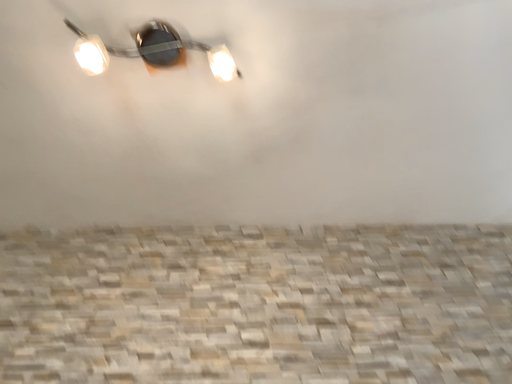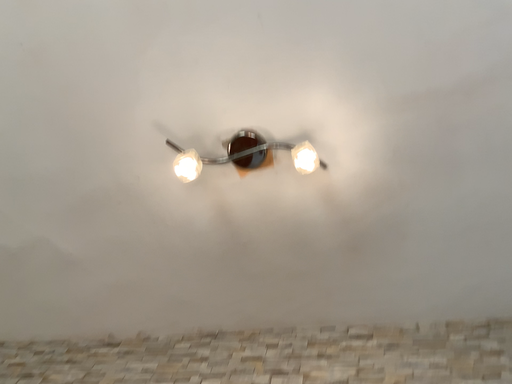
Question: Which way did the camera rotate in the video?

Choices:
 (A) rotated left
 (B) rotated right

Answer: (A)